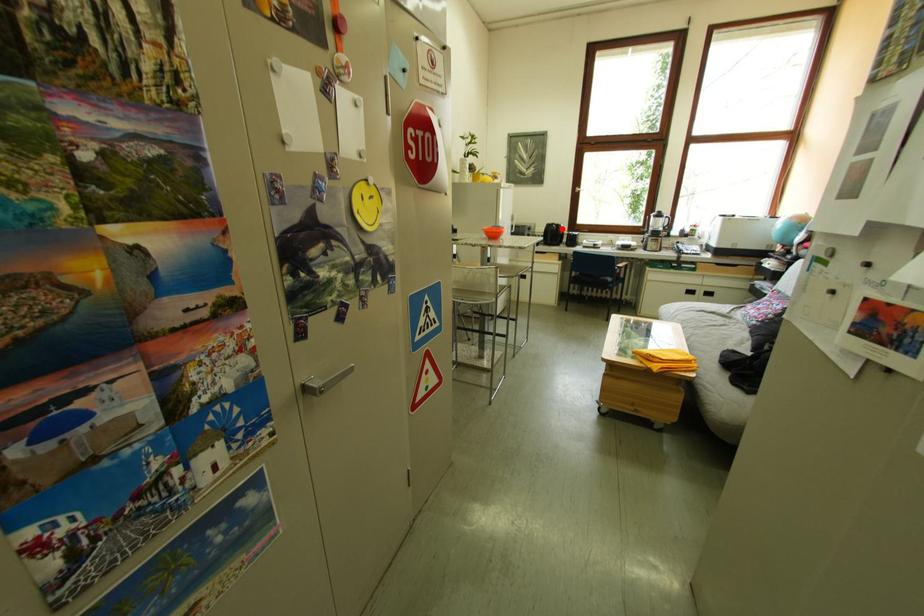
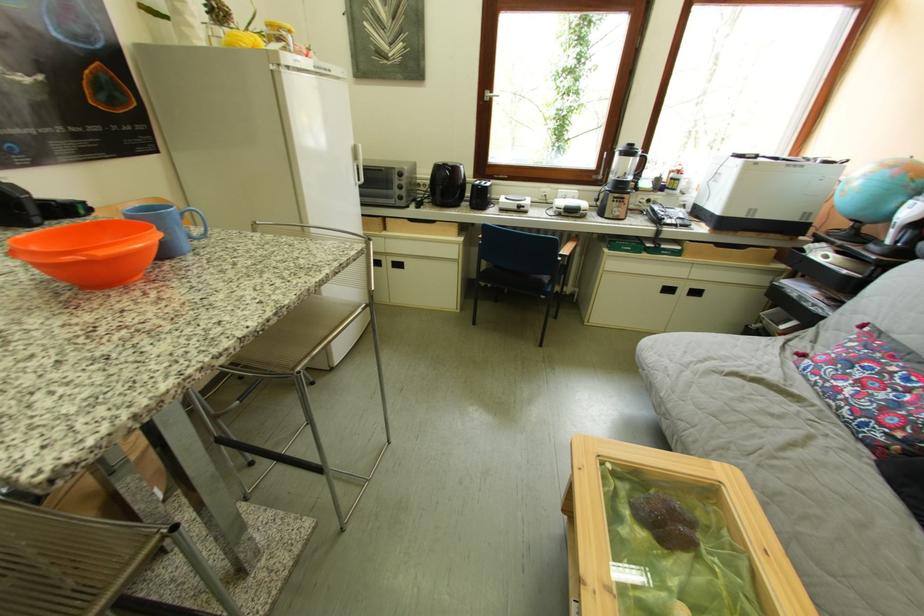
Question: I am providing you with two images of the same scene from different viewpoints. A red point is marked on the first image. Is the red point's position out of view in image 2?

Choices:
 (A) Yes
 (B) No

Answer: (B)